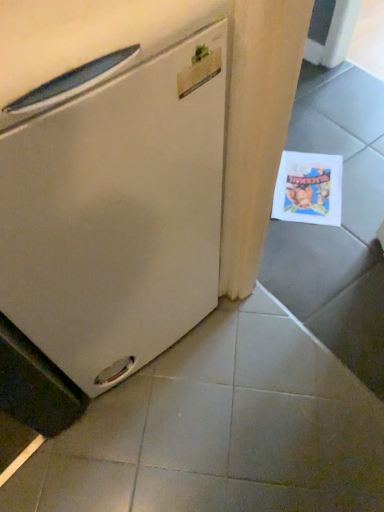
Question: From the image's perspective, is gray matte tile at lower center positioned above or below white matte refrigerator at left?

Choices:
 (A) below
 (B) above

Answer: (A)

Question: Would you say gray matte tile at lower center is inside or outside white matte refrigerator at left?

Choices:
 (A) inside
 (B) outside

Answer: (B)

Question: Based on their relative distances, which object is farther from the printed paper postcard at lower right?

Choices:
 (A) white matte refrigerator at left
 (B) gray matte tile at lower center

Answer: (A)

Question: Estimate the real-world distances between objects in this image. Which object is farther from the white matte refrigerator at left?

Choices:
 (A) printed paper postcard at lower right
 (B) gray matte tile at lower center

Answer: (A)